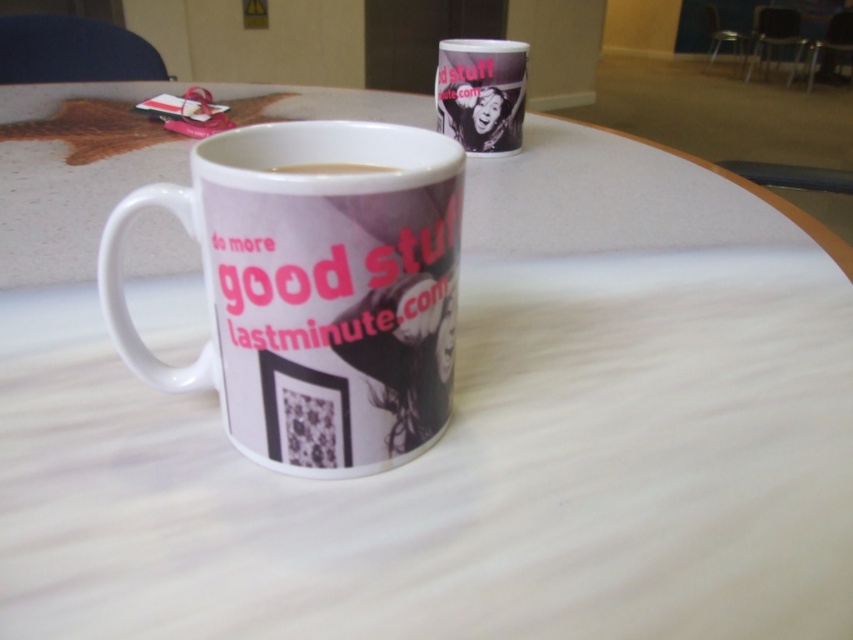
Between white ceramic mug at center and white paper cup at upper center, which one appears on the left side from the viewer's perspective?

From the viewer's perspective, white ceramic mug at center appears more on the left side.

Measure the distance between white ceramic mug at center and camera.

white ceramic mug at center and camera are 11.10 inches apart from each other.

Is point (396, 324) positioned before point (436, 129)?

Yes, it is.

This screenshot has height=640, width=853. Identify the location of white ceramic mug at center. [314, 291].

Does white paper cup at upper center appear over white glossy coffee cup at center?

Yes.

Does white paper cup at upper center appear on the right side of white glossy coffee cup at center?

Indeed, white paper cup at upper center is positioned on the right side of white glossy coffee cup at center.

Identify the location of white paper cup at upper center. (480, 93).

Where is `white paper cup at upper center`? The height and width of the screenshot is (640, 853). white paper cup at upper center is located at coordinates (480, 93).

Can you confirm if white ceramic mug at center is shorter than white glossy coffee cup at center?

No, white ceramic mug at center is not shorter than white glossy coffee cup at center.

Is white ceramic mug at center thinner than white glossy coffee cup at center?

No.

Which is behind, point (235, 253) or point (294, 164)?

The point (294, 164) is more distant.

Locate an element on the screen. white ceramic mug at center is located at coordinates (314, 291).